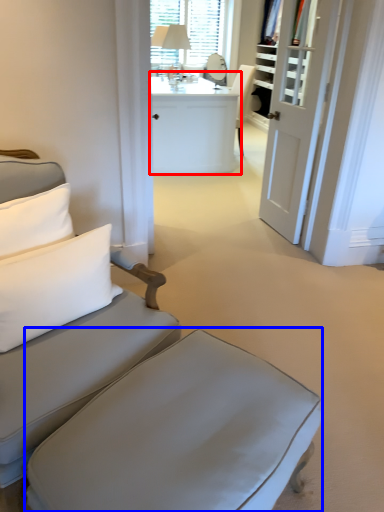
Question: Which object is further to the camera taking this photo, desk (highlighted by a red box) or table (highlighted by a blue box)?

Choices:
 (A) desk
 (B) table

Answer: (A)